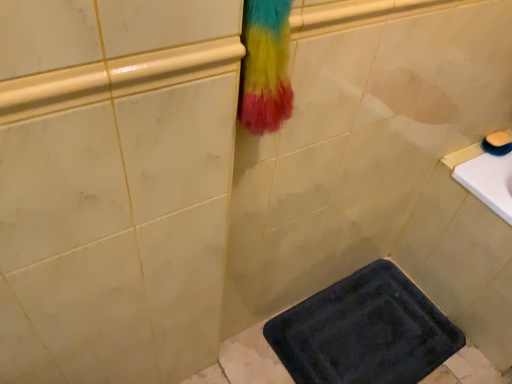
Image resolution: width=512 pixels, height=384 pixels. What do you see at coordinates (364, 331) in the screenshot?
I see `dark blue textured bath mat at lower center` at bounding box center [364, 331].

Locate an element on the screen. The image size is (512, 384). dark blue textured bath mat at lower center is located at coordinates (364, 331).

What is the approximate width of dark blue textured bath mat at lower center?

It is 41.65 centimeters.

What do you see at coordinates (499, 139) in the screenshot?
I see `smooth yellow soap at upper right` at bounding box center [499, 139].

Where is `smooth yellow soap at upper right`? The width and height of the screenshot is (512, 384). smooth yellow soap at upper right is located at coordinates (499, 139).

This screenshot has height=384, width=512. In order to click on dark blue textured bath mat at lower center in this screenshot , I will do `click(364, 331)`.

Is smooth yellow soap at upper right to the left of dark blue textured bath mat at lower center from the viewer's perspective?

In fact, smooth yellow soap at upper right is to the right of dark blue textured bath mat at lower center.

Does smooth yellow soap at upper right come behind dark blue textured bath mat at lower center?

Yes, smooth yellow soap at upper right is further from the camera.

Does point (509, 137) lie in front of point (329, 306)?

Yes, point (509, 137) is closer to viewer.

From the image's perspective, is smooth yellow soap at upper right on dark blue textured bath mat at lower center?

Yes, from the image's perspective, smooth yellow soap at upper right is on top of dark blue textured bath mat at lower center.

From a real-world perspective, which object rests below the other?

In real-world perspective, dark blue textured bath mat at lower center is lower.

Considering the sizes of objects smooth yellow soap at upper right and dark blue textured bath mat at lower center in the image provided, who is thinner, smooth yellow soap at upper right or dark blue textured bath mat at lower center?

smooth yellow soap at upper right.

Who is shorter, smooth yellow soap at upper right or dark blue textured bath mat at lower center?

dark blue textured bath mat at lower center is shorter.

Is smooth yellow soap at upper right smaller than dark blue textured bath mat at lower center?

Correct, smooth yellow soap at upper right occupies less space than dark blue textured bath mat at lower center.

Is dark blue textured bath mat at lower center located within smooth yellow soap at upper right?

No.

Are smooth yellow soap at upper right and dark blue textured bath mat at lower center located far from each other?

Actually, smooth yellow soap at upper right and dark blue textured bath mat at lower center are a little close together.

Is smooth yellow soap at upper right oriented towards dark blue textured bath mat at lower center?

No, smooth yellow soap at upper right is not turned towards dark blue textured bath mat at lower center.

How many degrees apart are the facing directions of smooth yellow soap at upper right and dark blue textured bath mat at lower center?

There is a 0.207-degree angle between the facing directions of smooth yellow soap at upper right and dark blue textured bath mat at lower center.

Where is `bath mat below the smooth yellow soap at upper right (from the image's perspective)`? This screenshot has height=384, width=512. bath mat below the smooth yellow soap at upper right (from the image's perspective) is located at coordinates (364, 331).

Is dark blue textured bath mat at lower center to the left or to the right of smooth yellow soap at upper right in the image?

From the image, it's evident that dark blue textured bath mat at lower center is to the left of smooth yellow soap at upper right.

In the image, is dark blue textured bath mat at lower center positioned in front of or behind smooth yellow soap at upper right?

In the image, dark blue textured bath mat at lower center appears in front of smooth yellow soap at upper right.

Does point (298, 362) appear closer or farther from the camera than point (509, 143)?

Clearly, point (298, 362) is closer to the camera than point (509, 143).

From the image's perspective, does dark blue textured bath mat at lower center appear lower than smooth yellow soap at upper right?

Yes, from the image's perspective, dark blue textured bath mat at lower center is beneath smooth yellow soap at upper right.

From a real-world perspective, is dark blue textured bath mat at lower center below smooth yellow soap at upper right?

Yes, from a real-world perspective, dark blue textured bath mat at lower center is beneath smooth yellow soap at upper right.

In terms of width, does dark blue textured bath mat at lower center look wider or thinner when compared to smooth yellow soap at upper right?

Considering their sizes, dark blue textured bath mat at lower center looks broader than smooth yellow soap at upper right.

Considering the sizes of objects dark blue textured bath mat at lower center and smooth yellow soap at upper right in the image provided, who is taller, dark blue textured bath mat at lower center or smooth yellow soap at upper right?

smooth yellow soap at upper right.

Based on their sizes in the image, would you say dark blue textured bath mat at lower center is bigger or smaller than smooth yellow soap at upper right?

dark blue textured bath mat at lower center is bigger than smooth yellow soap at upper right.

Is smooth yellow soap at upper right completely or partially inside dark blue textured bath mat at lower center?

No, dark blue textured bath mat at lower center does not contain smooth yellow soap at upper right.

Would you consider dark blue textured bath mat at lower center to be distant from smooth yellow soap at upper right?

dark blue textured bath mat at lower center is near smooth yellow soap at upper right, not far away.

Is dark blue textured bath mat at lower center turned away from smooth yellow soap at upper right?

No, smooth yellow soap at upper right is not at the back of dark blue textured bath mat at lower center.

How many degrees apart are the facing directions of dark blue textured bath mat at lower center and smooth yellow soap at upper right?

0.207 degrees separate the facing orientations of dark blue textured bath mat at lower center and smooth yellow soap at upper right.

Where is `soap above the dark blue textured bath mat at lower center (from the image's perspective)`? The width and height of the screenshot is (512, 384). soap above the dark blue textured bath mat at lower center (from the image's perspective) is located at coordinates (499, 139).

Locate an element on the screen. bath mat below the smooth yellow soap at upper right (from the image's perspective) is located at coordinates (364, 331).

Locate an element on the screen. soap that is behind the dark blue textured bath mat at lower center is located at coordinates (499, 139).